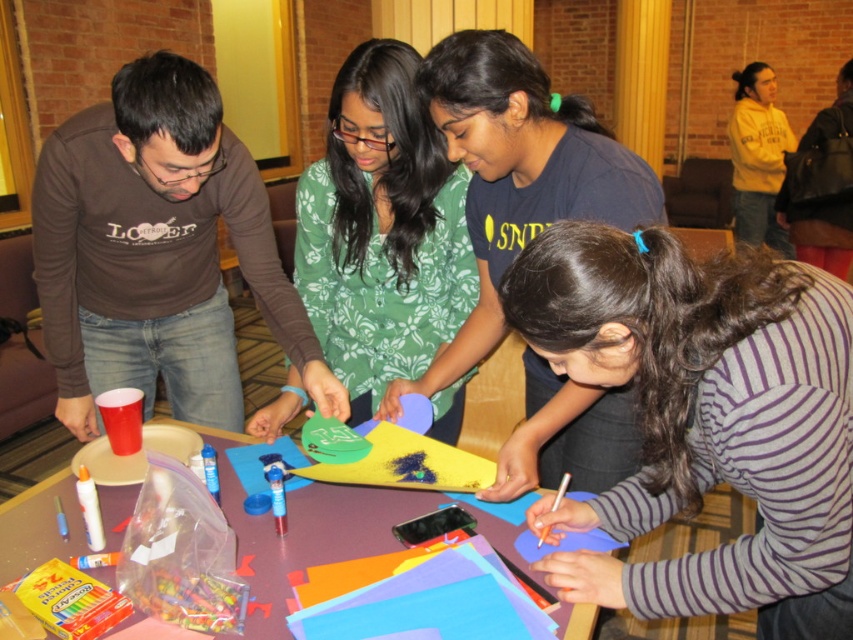
Does green floral shirt at center have a larger size compared to matte plastic table at center?

Correct, green floral shirt at center is larger in size than matte plastic table at center.

Does green floral shirt at center have a lesser width compared to matte plastic table at center?

Indeed, green floral shirt at center has a lesser width compared to matte plastic table at center.

Is point (339, 148) positioned before point (267, 518)?

That is False.

Locate an element on the screen. green floral shirt at center is located at coordinates (381, 228).

Can you confirm if green floral shirt at center is smaller than yellow fleece sweatshirt at upper right?

Indeed, green floral shirt at center has a smaller size compared to yellow fleece sweatshirt at upper right.

Who is more distant from viewer, [403,97] or [781,150]?

Point [781,150]

Does point (430, 269) come behind point (746, 163)?

No.

You are a GUI agent. You are given a task and a screenshot of the screen. Output one action in this format:
    pyautogui.click(x=<x>, y=<y>)
    Task: Click on the green floral shirt at center
    The height and width of the screenshot is (640, 853).
    Given the screenshot: What is the action you would take?
    pyautogui.click(x=381, y=228)

Describe the element at coordinates (517, 173) in the screenshot. I see `matte blue shirt at center` at that location.

Between matte blue shirt at center and matte plastic table at center, which one has more height?

With more height is matte blue shirt at center.

Is point (490, 228) positioned behind point (283, 634)?

Yes.

Locate an element on the screen. This screenshot has height=640, width=853. matte blue shirt at center is located at coordinates (517, 173).